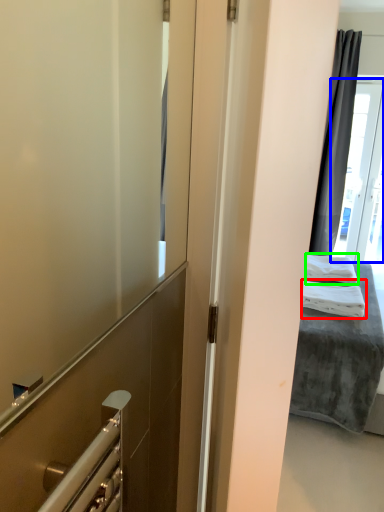
Question: Estimate the real-world distances between objects in this image. Which object is closer to bath towel (highlighted by a red box), glass door (highlighted by a blue box) or bath towel (highlighted by a green box)?

Choices:
 (A) glass door
 (B) bath towel

Answer: (B)